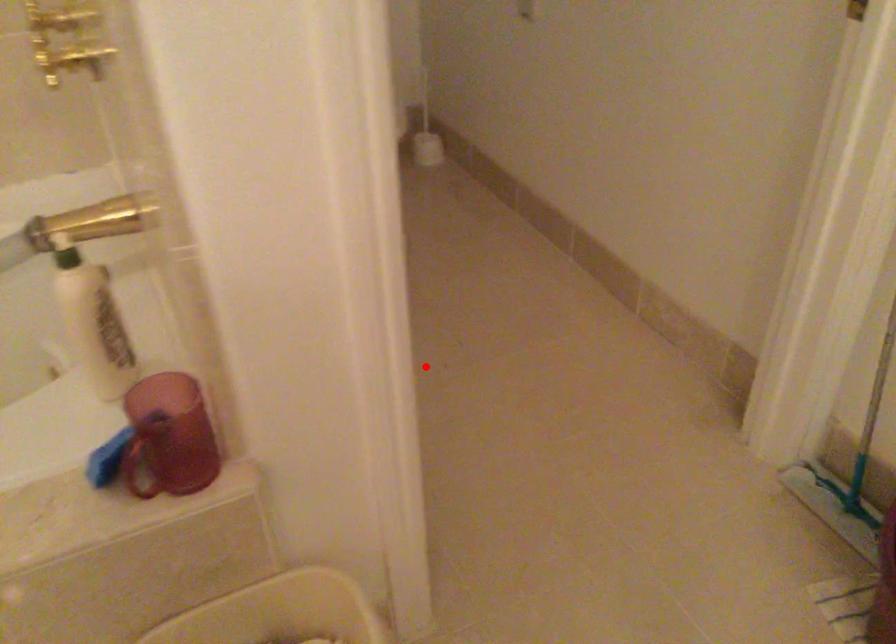
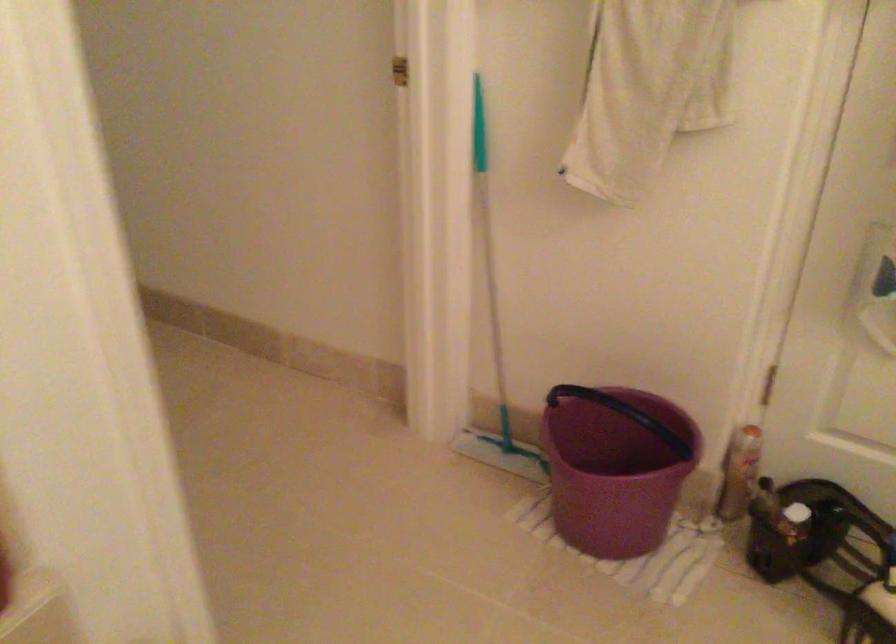
Question: I am providing you with two images of the same scene from different viewpoints. A red point is marked on the first image. Can you still see the location of the red point in image 2?

Choices:
 (A) Yes
 (B) No

Answer: (B)